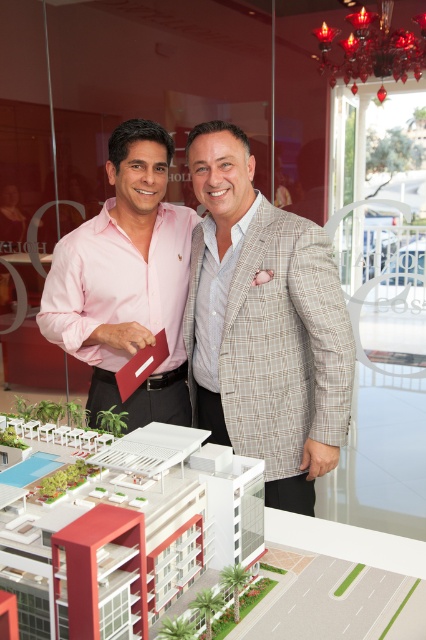
You are a photographer positioned in front of the architectural model. You notice two points marked on the model at coordinates point (244,406) and point (155,406). Which point is closer to your camera lens?

→ Point (244,406) is closer to the viewer than point (155,406), so the point at coordinates point (244,406) is closer to your camera lens.

You are a photographer setting up a shoot in the described scene. You need to position a light to the left of the plaid wool blazer at center and to the right of the pink cotton shirt at center. Is this possible based on their current positions?

The plaid wool blazer at center is to the right of the pink cotton shirt at center, so placing a light to the left of the plaid wool blazer at center and to the right of the pink cotton shirt at center is possible as they are positioned in a way that allows space between them for the light.

You are an interior designer who needs to choose between two garments for a presentation. The plaid wool blazer at center and the pink cotton shirt at center are both in the scene. Based on their sizes in the image, which one would you choose if you want the garment to appear more prominent in your presentation slides?

The pink cotton shirt at center is larger than the plaid wool blazer at center, so choosing the pink cotton shirt at center would make it appear more prominent in the presentation slides.